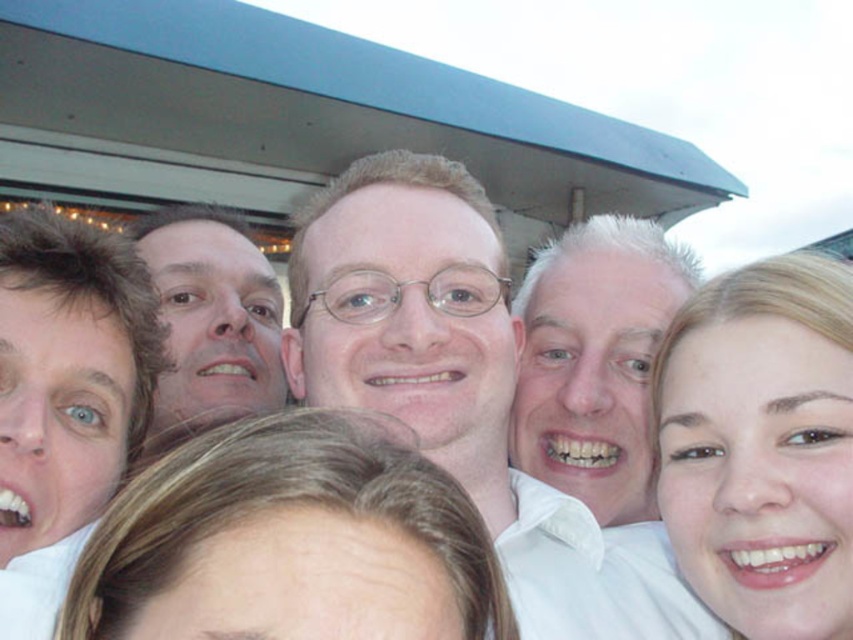
Question: Is white glossy shirt at center wider than smooth skin face at center?

Choices:
 (A) yes
 (B) no

Answer: (A)

Question: Does blonde hair at center appear on the left side of white glossy shirt at center?

Choices:
 (A) no
 (B) yes

Answer: (B)

Question: In this image, where is smooth blonde hair at center located relative to smooth skin face at center?

Choices:
 (A) right
 (B) left

Answer: (A)

Question: Which object is closer to the camera taking this photo?

Choices:
 (A) white glossy shirt at center
 (B) smooth skin face at center
 (C) blonde hair at center
 (D) smooth blonde hair at center

Answer: (C)

Question: Estimate the real-world distances between objects in this image. Which object is closer to the white glossy shirt at center?

Choices:
 (A) blonde hair at center
 (B) smooth skin face at center

Answer: (B)

Question: Considering the real-world distances, which object is closest to the smooth blonde hair at center?

Choices:
 (A) smooth skin face at center
 (B) blonde hair at center
 (C) white glossy shirt at center

Answer: (C)